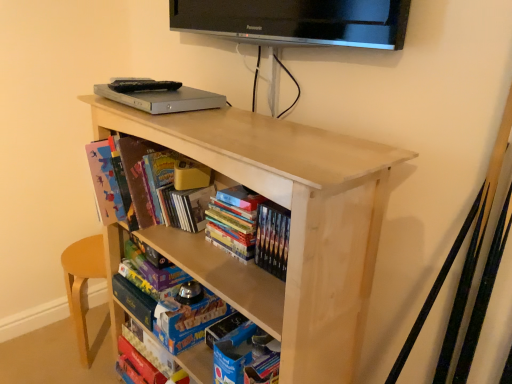
Question: Is natural wood shelf at center completely or partially inside matte cardboard book at lower center, the 1th book positioned from the bottom?

Choices:
 (A) yes
 (B) no

Answer: (B)

Question: Can you confirm if matte cardboard book at lower center, the 1th book positioned from the bottom, is thinner than natural wood shelf at center?

Choices:
 (A) yes
 (B) no

Answer: (A)

Question: Is matte cardboard book at lower center, the 1th book positioned from the bottom, bigger than natural wood shelf at center?

Choices:
 (A) yes
 (B) no

Answer: (B)

Question: Can we say matte cardboard book at lower center, which is the fourth book in top-to-bottom order, lies outside natural wood shelf at center?

Choices:
 (A) yes
 (B) no

Answer: (B)

Question: Does matte cardboard book at lower center, which is the fourth book in top-to-bottom order, lie behind natural wood shelf at center?

Choices:
 (A) yes
 (B) no

Answer: (A)

Question: Is natural wood shelf at center at the back of matte cardboard book at lower center, which is the fourth book in top-to-bottom order?

Choices:
 (A) no
 (B) yes

Answer: (B)

Question: Is blue cardboard book at lower center with hardcover book at center, acting as the 3th book starting from the bottom?

Choices:
 (A) no
 (B) yes

Answer: (A)

Question: From a real-world perspective, is blue cardboard book at lower center physically above hardcover book at center, the second book positioned from the top?

Choices:
 (A) yes
 (B) no

Answer: (B)

Question: Does blue cardboard book at lower center come behind hardcover book at center, acting as the 3th book starting from the bottom?

Choices:
 (A) no
 (B) yes

Answer: (B)

Question: Does blue cardboard book at lower center have a greater height compared to hardcover book at center, the second book positioned from the top?

Choices:
 (A) yes
 (B) no

Answer: (B)

Question: From a real-world perspective, does blue cardboard book at lower center sit lower than hardcover book at center, acting as the 3th book starting from the bottom?

Choices:
 (A) no
 (B) yes

Answer: (B)

Question: Would you say blue cardboard book at lower center is a long distance from hardcover book at center, acting as the 3th book starting from the bottom?

Choices:
 (A) yes
 (B) no

Answer: (B)

Question: From a real-world perspective, is hardcover books at center, arranged as the third book when viewed from the top, beneath hardcover book at center, the second book positioned from the top?

Choices:
 (A) no
 (B) yes

Answer: (A)